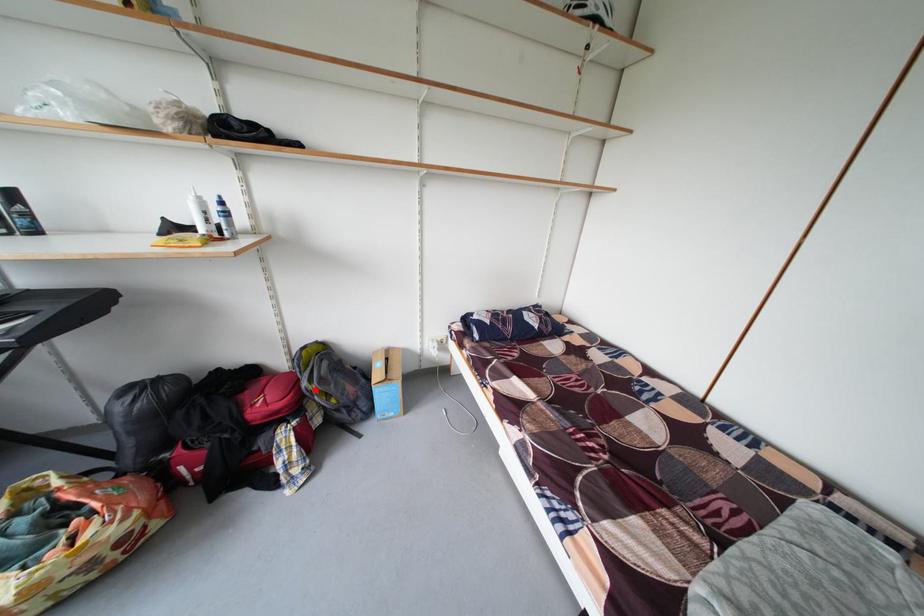
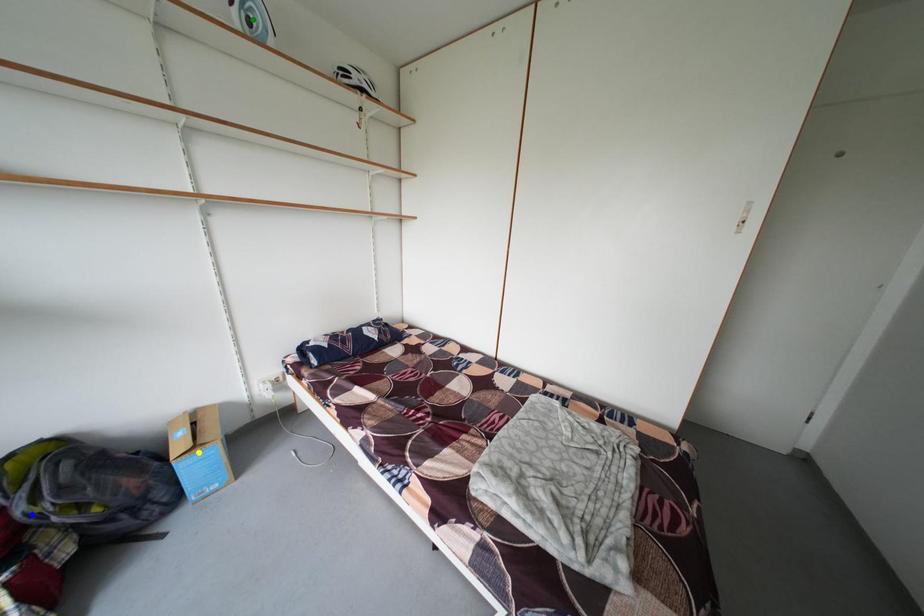
Question: I am providing you with two images of the same scene from different viewpoints. A red point is marked on the first image. You are given multiple points on the second image. Which mark in image 2 goes with the point in image 1?

Choices:
 (A) green point
 (B) yellow point
 (C) blue point

Answer: (C)